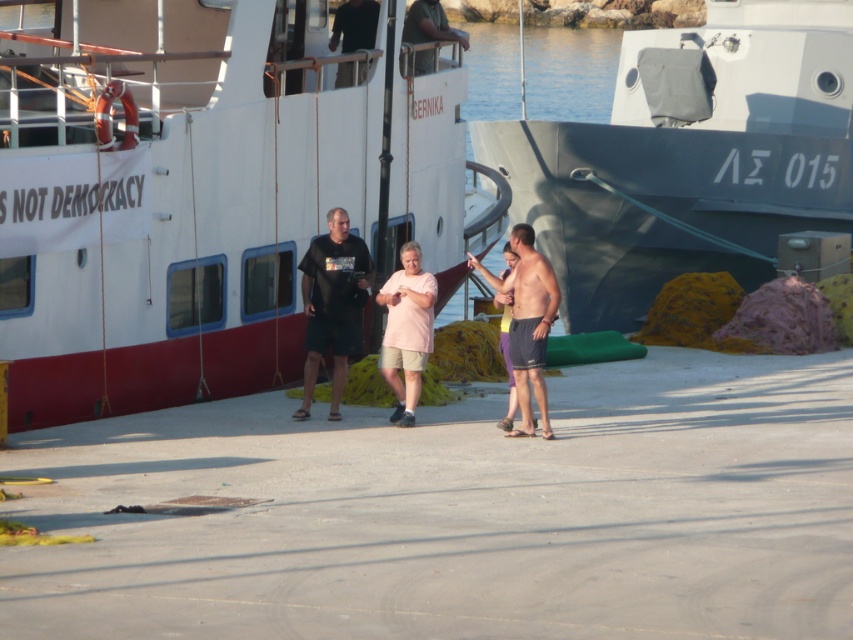
You are a photographer trying to capture a group photo of the people on the dock. You notice two individuals wearing a black matte shirt at upper center and a dark green fabric shirt at upper center. Which shirt is positioned more to the left in the frame?

The black matte shirt at upper center is positioned more to the left than the dark green fabric shirt at upper center.

You are a photographer at the dock and want to capture both the pink matte shorts at center and the dark green fabric shirt at upper center in the same frame. Which object should you focus on first to ensure both are in the frame?

You should focus on the pink matte shorts at center first since it is taller than the dark green fabric shirt at upper center, ensuring both are visible in the frame.

You are a photographer at the dock and want to capture both the pink matte shorts at center and the dark green fabric shirt at upper center in a single photo. Which object should you focus on to ensure both are visible without cropping?

You should focus on the dark green fabric shirt at upper center because it occupies more space than the pink matte shorts at center, ensuring both can fit into the frame.